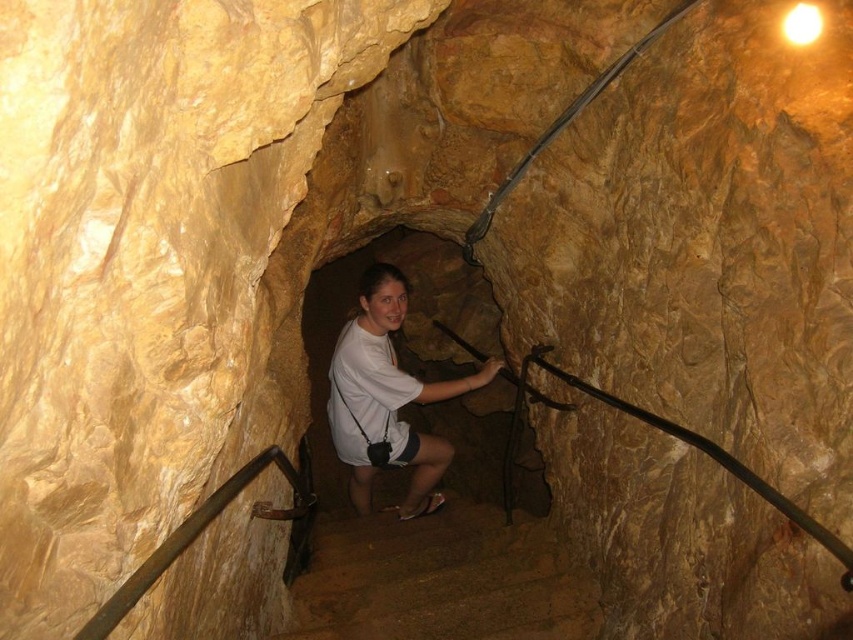
Is brown stone stairs at center taller than white matte shirt at center?

Incorrect, brown stone stairs at center's height is not larger of white matte shirt at center's.

Locate an element on the screen. brown stone stairs at center is located at coordinates tap(440, 580).